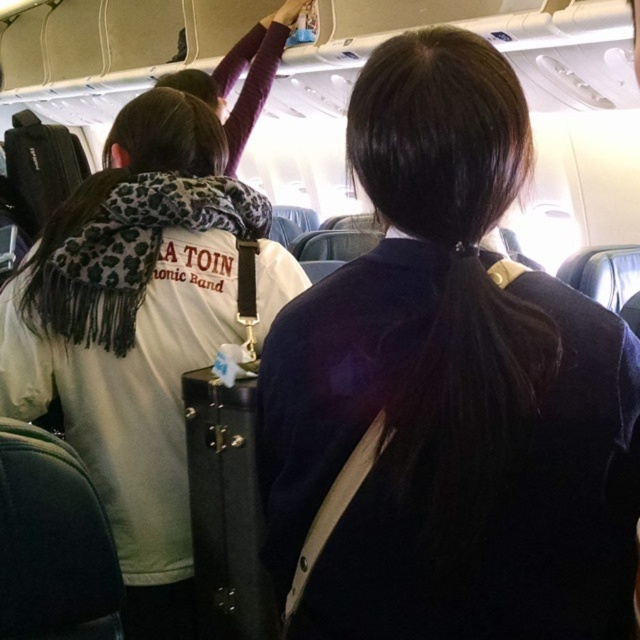
Does dark blue fabric at center appear on the right side of white fleece jacket at upper left?

Correct, you'll find dark blue fabric at center to the right of white fleece jacket at upper left.

Is point (358, 618) in front of point (144, 317)?

Yes, point (358, 618) is closer to viewer.

What are the coordinates of `dark blue fabric at center` in the screenshot? It's located at (449, 388).